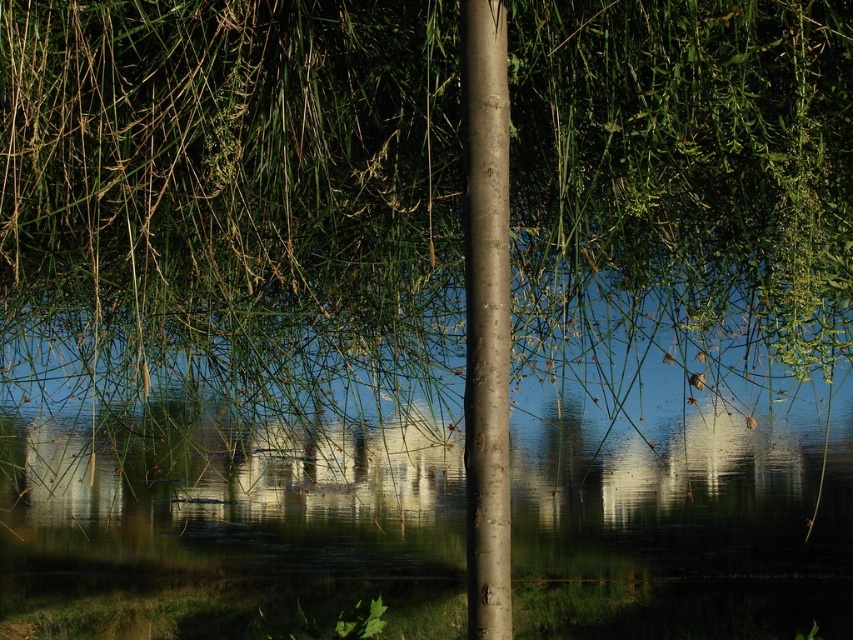
Can you confirm if clear water at center is positioned above smooth brown pole at center?

No, clear water at center is not above smooth brown pole at center.

Which is below, clear water at center or smooth brown pole at center?

clear water at center

Is point (296, 573) positioned before point (496, 336)?

No, it is behind (496, 336).

The width and height of the screenshot is (853, 640). In order to click on clear water at center in this screenshot , I will do `click(225, 516)`.